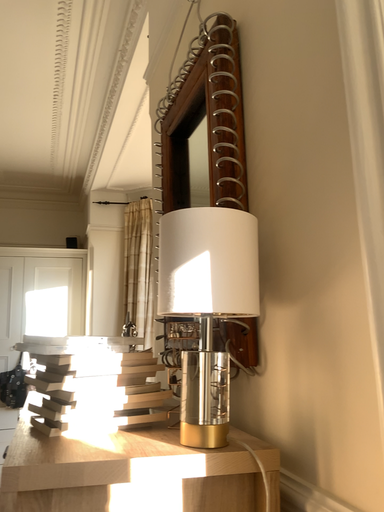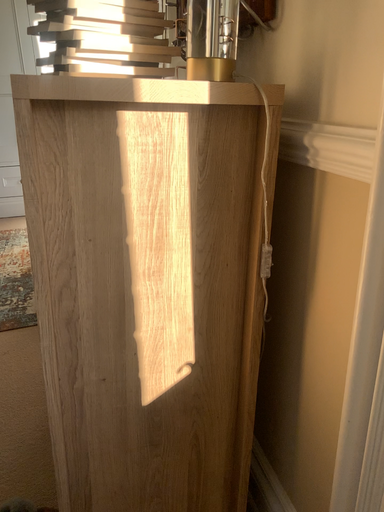
Question: Which way did the camera rotate in the video?

Choices:
 (A) rotated upward
 (B) rotated downward

Answer: (B)